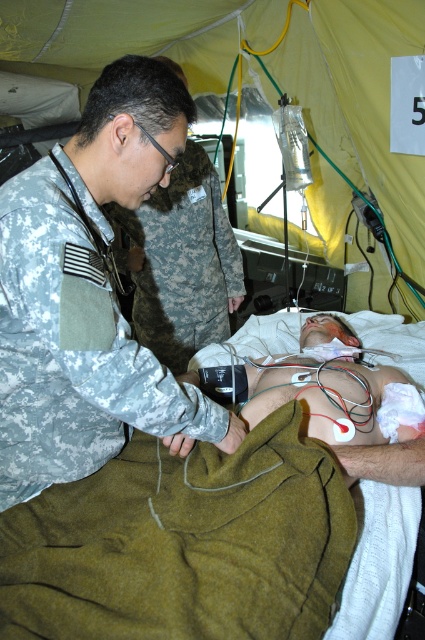
Which is above, matte green tent at center or camo fabric uniform at upper left?

matte green tent at center is above.

Is matte green tent at center closer to camera compared to camo fabric uniform at upper left?

That is True.

Is point (368, 84) less distant than point (178, 368)?

No.

What are the coordinates of `matte green tent at center` in the screenshot? It's located at (359, 100).

Does point (90, 305) lie behind point (153, 241)?

No.

Does camouflage uniform at center have a greater height compared to camo fabric uniform at upper left?

Yes, camouflage uniform at center is taller than camo fabric uniform at upper left.

Who is more distant from viewer, (51,440) or (187,298)?

Positioned behind is point (187,298).

The image size is (425, 640). I want to click on camouflage uniform at center, so click(x=87, y=292).

Between camouflage uniform at center and matte green tent at center, which one is positioned lower?

camouflage uniform at center is lower down.

Between camouflage uniform at center and matte green tent at center, which one is positioned higher?

Positioned higher is matte green tent at center.

Who is more forward, (23, 269) or (345, 164)?

Point (23, 269) is more forward.

Image resolution: width=425 pixels, height=640 pixels. I want to click on camouflage uniform at center, so click(87, 292).